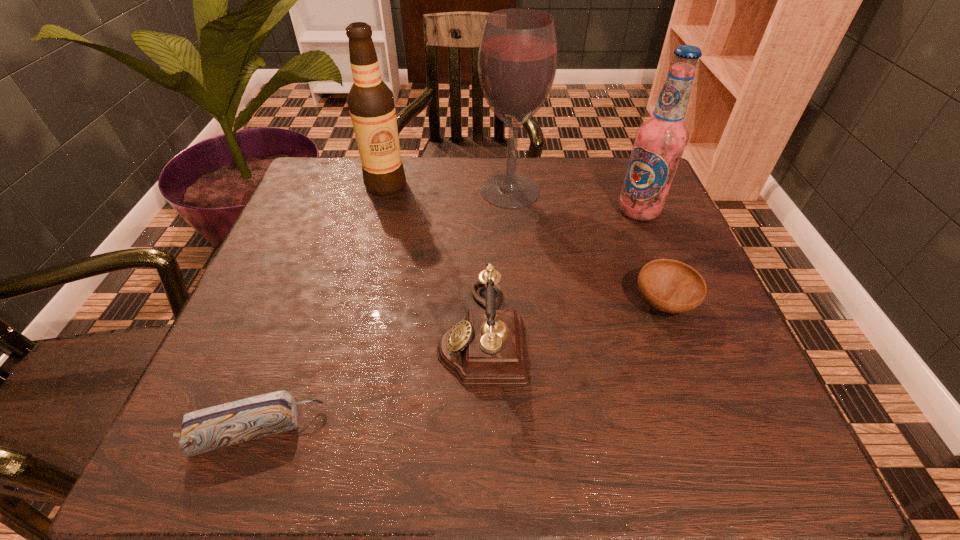
Where is `vacant area located 0.170m on the dial of the telephone`? vacant area located 0.170m on the dial of the telephone is located at coordinates (348, 332).

This screenshot has width=960, height=540. I want to click on free region located on the dial of the telephone, so click(x=385, y=332).

Identify the location of vacant position located on the left of the bowl. (435, 303).

At what (x,y) coordinates should I click in order to perform the action: click on vacant area situated 0.260m on the right of the pencil box. Please return your answer as a coordinate pair (x, y). The height and width of the screenshot is (540, 960). Looking at the image, I should click on (487, 430).

Identify the location of object at the near edge. The height and width of the screenshot is (540, 960). coord(219,426).

The width and height of the screenshot is (960, 540). Identify the location of object at the left edge. pyautogui.click(x=219, y=426).

I want to click on alcohol located at the right edge, so click(659, 142).

Find the location of `bowl present at the right edge`. bowl present at the right edge is located at coordinates (671, 286).

Locate an element on the screen. object that is at the near left corner is located at coordinates (219, 426).

The height and width of the screenshot is (540, 960). Identify the location of object present at the far right corner. (659, 142).